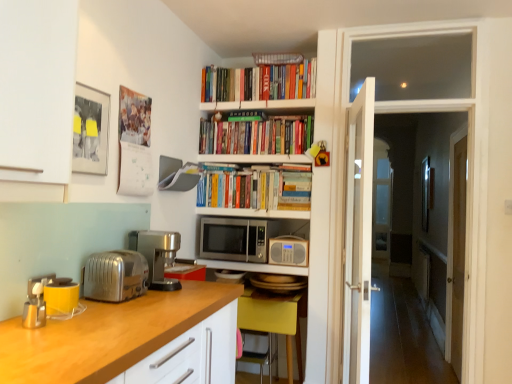
Question: Is metallic yellow toaster at left, the 1th appliance viewed from the front, not inside satin silver coffee machine at left?

Choices:
 (A) yes
 (B) no

Answer: (A)

Question: From the image's perspective, is metallic yellow toaster at left, the 1th appliance viewed from the front, located above satin silver coffee machine at left?

Choices:
 (A) yes
 (B) no

Answer: (B)

Question: Can you confirm if metallic yellow toaster at left, which is the fourth appliance in back-to-front order, is taller than satin silver coffee machine at left?

Choices:
 (A) no
 (B) yes

Answer: (A)

Question: Does metallic yellow toaster at left, the 2th appliance from the left, have a lesser height compared to satin silver coffee machine at left?

Choices:
 (A) yes
 (B) no

Answer: (A)

Question: Could you tell me if metallic yellow toaster at left, which is the fourth appliance in back-to-front order, is turned towards satin silver coffee machine at left?

Choices:
 (A) no
 (B) yes

Answer: (A)

Question: In terms of size, does satin silver coffee machine at left appear bigger or smaller than stainless steel microwave at center?

Choices:
 (A) small
 (B) big

Answer: (A)

Question: Is satin silver coffee machine at left in front of or behind stainless steel microwave at center in the image?

Choices:
 (A) front
 (B) behind

Answer: (A)

Question: From the image's perspective, is satin silver coffee machine at left above or below stainless steel microwave at center?

Choices:
 (A) above
 (B) below

Answer: (A)

Question: Considering the positions of point 177,236 and point 224,243, is point 177,236 closer or farther from the camera than point 224,243?

Choices:
 (A) farther
 (B) closer

Answer: (B)

Question: Is point (31, 288) positioned closer to the camera than point (452, 274)?

Choices:
 (A) farther
 (B) closer

Answer: (B)

Question: Considering the positions of metallic silver toaster at left, which is the 1th appliance in left-to-right order, and transparent glass door at right in the image, is metallic silver toaster at left, which is the 1th appliance in left-to-right order, wider or thinner than transparent glass door at right?

Choices:
 (A) wide
 (B) thin

Answer: (B)

Question: From a real-world perspective, is metallic silver toaster at left, placed as the 4th appliance when sorted from right to left, physically located above or below transparent glass door at right?

Choices:
 (A) below
 (B) above

Answer: (B)

Question: Based on their positions, is metallic silver toaster at left, which is the 1th appliance in left-to-right order, located to the left or right of transparent glass door at right?

Choices:
 (A) left
 (B) right

Answer: (A)

Question: Is hardcover books at upper center, which is the second book in bottom-to-top order, to the left or to the right of metallic yellow toaster at left, which is the 3th appliance from right to left, in the image?

Choices:
 (A) right
 (B) left

Answer: (A)

Question: From the image's perspective, is hardcover books at upper center, which ranks as the second book in top-to-bottom order, positioned above or below metallic yellow toaster at left, which is the 3th appliance from right to left?

Choices:
 (A) above
 (B) below

Answer: (A)